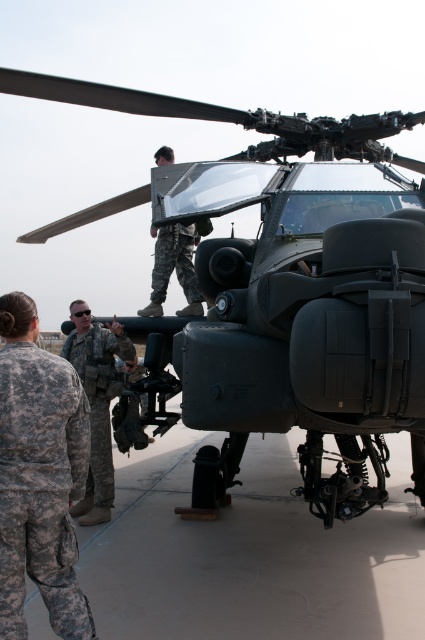
You are a military analyst reviewing this image. You need to locate the camouflage fabric uniform at lower left. What are its coordinates?

The camouflage fabric uniform at lower left is located at coordinates point (x=39, y=476).

You are a military engineer tasked with inspecting the helicopter. You need to reach the point at coordinate point (36, 449) to check for damage. If your ladder is 8 feet long, will it be sufficient to reach that point?

The distance of point (36, 449) from the viewer is 8.40 feet. Since the ladder is only 8 feet long, it is 0.40 feet shorter than required. Therefore, the ladder will not be sufficient to reach the point.